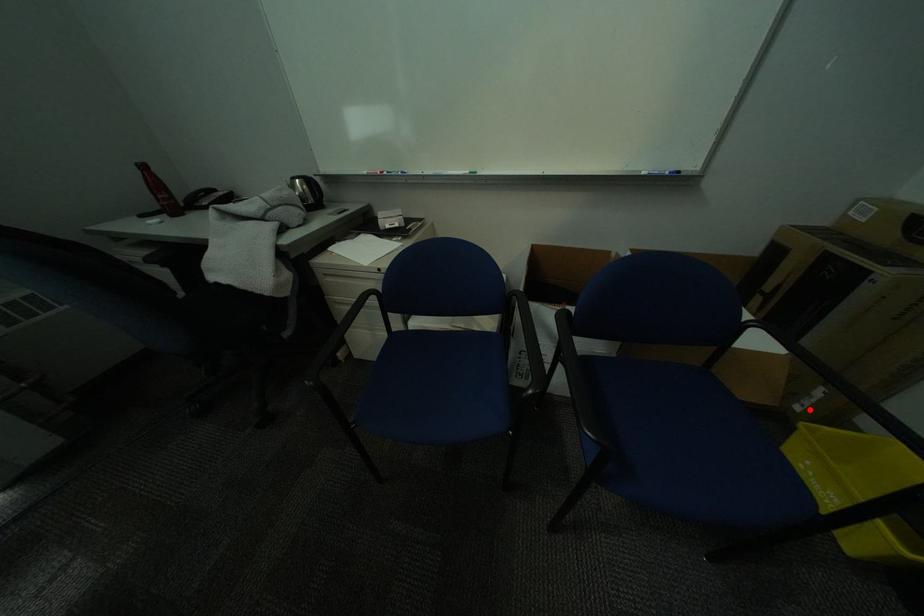
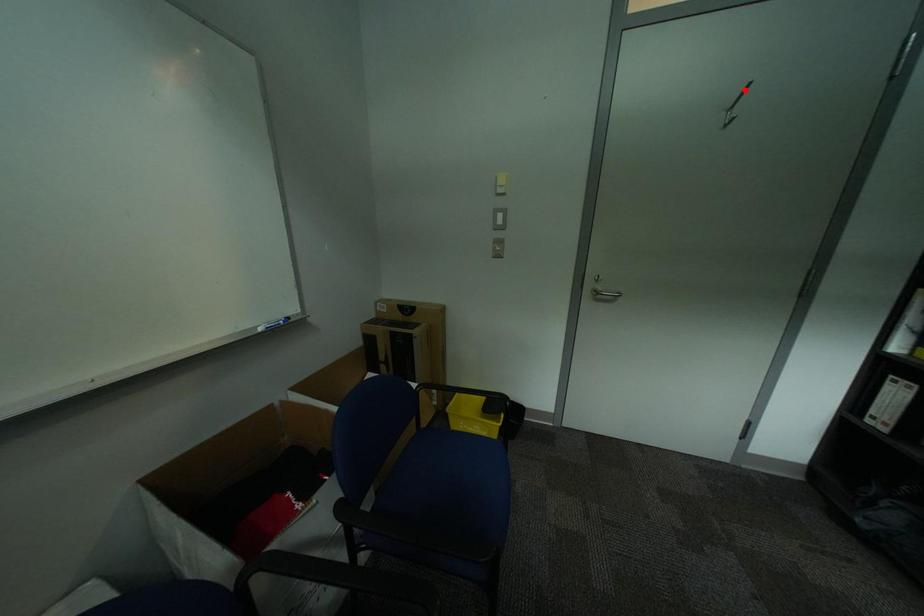
I am providing you with two images of the same scene from different viewpoints. A red point is marked on the first image and another point is marked on the second image. Do the highlighted points in image1 and image2 indicate the same real-world spot?

No